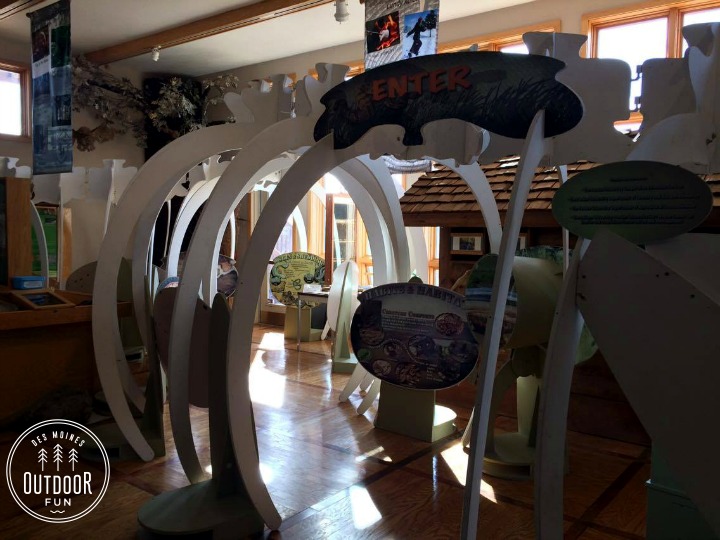
Identify the location of keyboard. This screenshot has width=720, height=540. (42, 300).